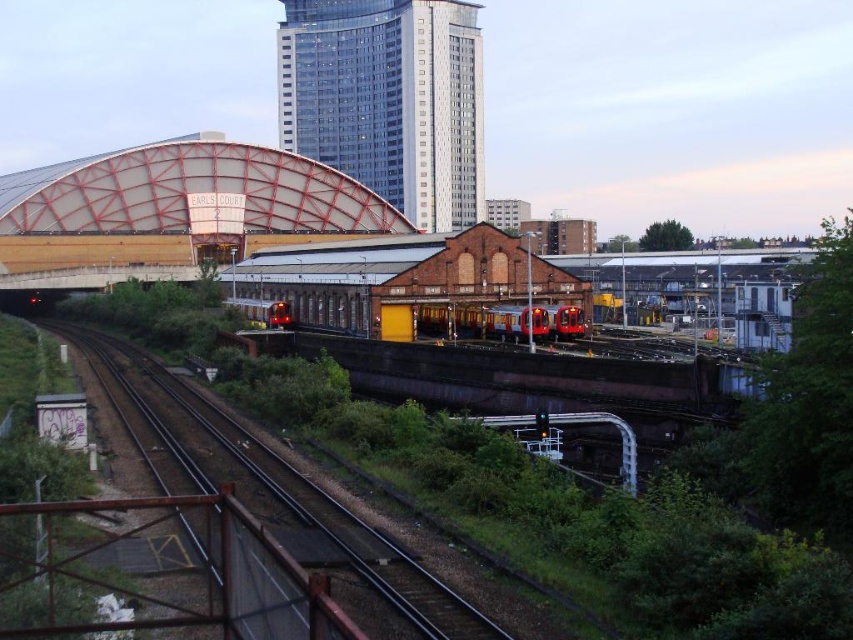
Question: Is smooth metal train track at center positioned behind red metallic train at center?

Choices:
 (A) yes
 (B) no

Answer: (B)

Question: Among these points, which one is farthest from the camera?

Choices:
 (A) (256, 310)
 (B) (303, 29)
 (C) (471, 314)
 (D) (161, 380)

Answer: (B)

Question: Considering the relative positions of red metallic train at center and matte red train at center in the image provided, where is red metallic train at center located with respect to matte red train at center?

Choices:
 (A) left
 (B) right

Answer: (B)

Question: Which object is positioned farthest from the red metallic train at center?

Choices:
 (A) smooth metal train track at center
 (B) matte red train at center
 (C) glassy metallic skyscraper at upper center

Answer: (C)

Question: Can you confirm if smooth metal train track at center is positioned below matte red train at center?

Choices:
 (A) yes
 (B) no

Answer: (A)

Question: Which object appears closest to the camera in this image?

Choices:
 (A) glassy metallic skyscraper at upper center
 (B) smooth metal train track at center

Answer: (B)